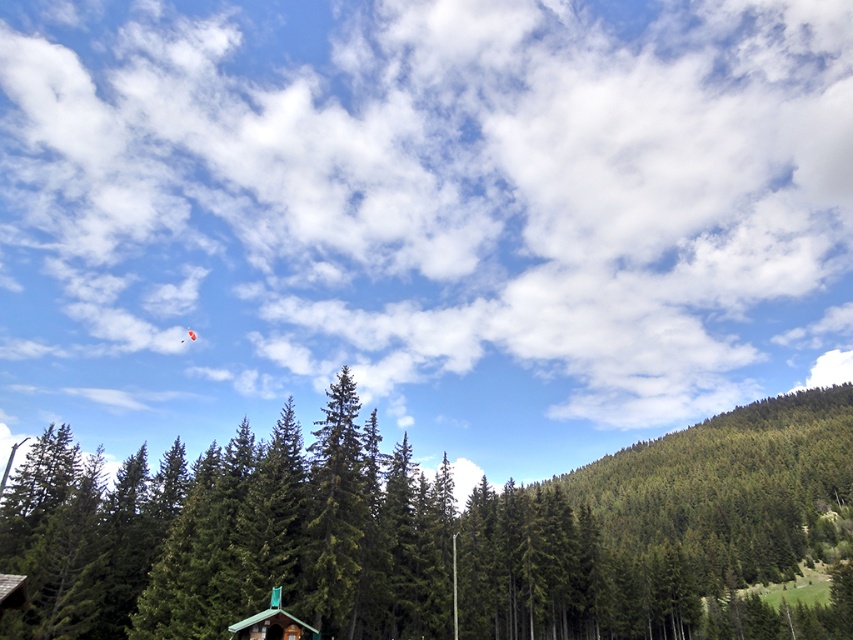
Between green matte tree at center and green matte cabin at lower center, which one is positioned higher?

green matte cabin at lower center is above.

Who is more forward, (183,509) or (280,628)?

Positioned in front is point (280,628).

Image resolution: width=853 pixels, height=640 pixels. What are the coordinates of `green matte tree at center` in the screenshot? It's located at (431, 532).